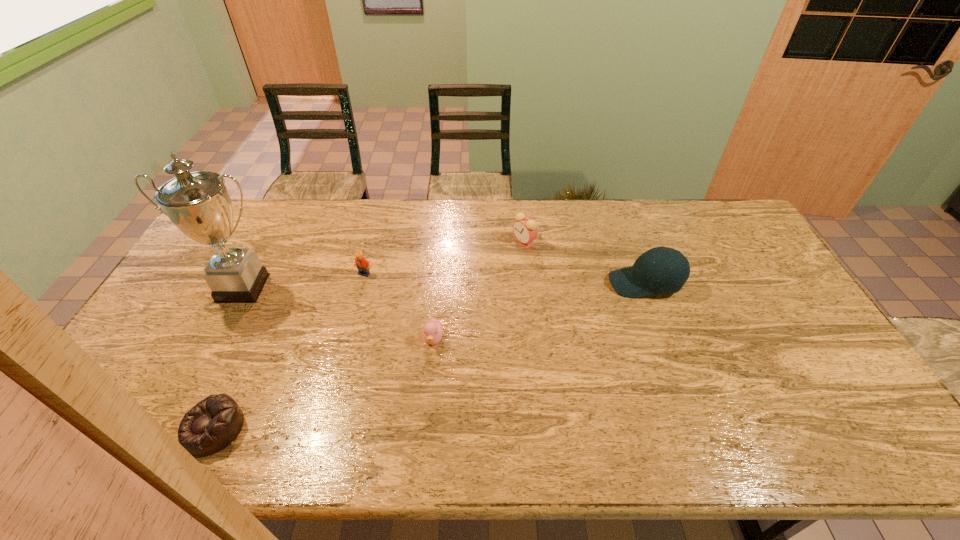
Where is `vacant space located 0.130m on the front-facing side of the baseball cap`? vacant space located 0.130m on the front-facing side of the baseball cap is located at coordinates (567, 284).

Find the location of a particular element. This screenshot has width=960, height=540. vacant space located 0.280m on the front-facing side of the baseball cap is located at coordinates (519, 284).

This screenshot has height=540, width=960. What are the coordinates of `vacant region located on the front-facing side of the baseball cap` in the screenshot? It's located at (548, 284).

Find the location of `free spot located 0.140m on the face of the farthest object`. free spot located 0.140m on the face of the farthest object is located at coordinates (472, 242).

Identify the location of vacant space located 0.300m on the face of the farthest object. (426, 242).

Find the location of `vacant space located 0.310m on the face of the farthest object`. vacant space located 0.310m on the face of the farthest object is located at coordinates (423, 242).

Where is `free space located on the front-facing side of the Lego`? This screenshot has height=540, width=960. free space located on the front-facing side of the Lego is located at coordinates (345, 346).

You are a GUI agent. You are given a task and a screenshot of the screen. Output one action in this format:
    pyautogui.click(x=<x>, y=<y>)
    Task: Click on the free region located on the front-facing side of the fifth farthest object
    This screenshot has width=960, height=540.
    Given the screenshot: What is the action you would take?
    pyautogui.click(x=428, y=404)

Locate an element on the screen. The image size is (960, 540). free location located 0.100m on the back of the nearest object is located at coordinates (241, 368).

Where is `object at the far edge`? This screenshot has width=960, height=540. object at the far edge is located at coordinates (525, 230).